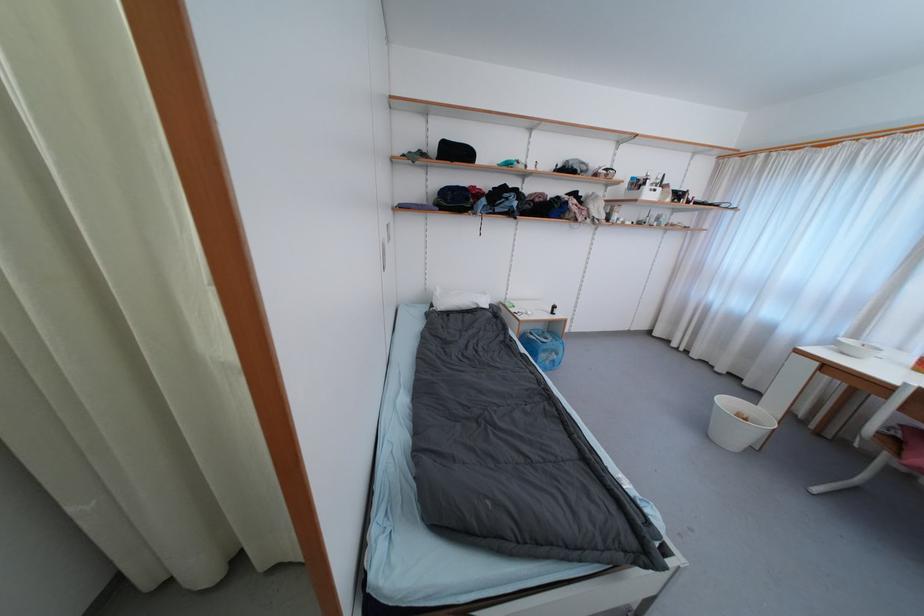
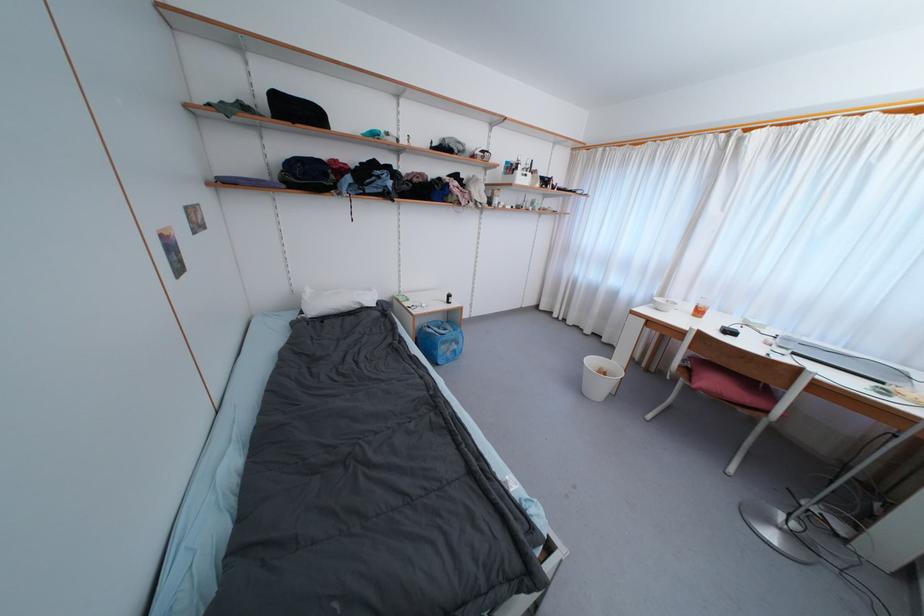
Question: The camera is either moving clockwise (left) or counter-clockwise (right) around the object. The first image is from the beginning of the video and the second image is from the end. Is the camera moving left or right when shooting the video?

Choices:
 (A) Left
 (B) Right

Answer: (A)